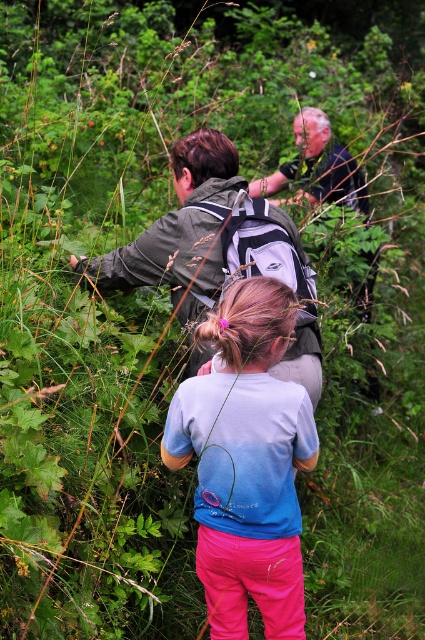
The height and width of the screenshot is (640, 425). Describe the element at coordinates (203, 234) in the screenshot. I see `green fabric jacket at center` at that location.

I want to click on green fabric jacket at center, so click(203, 234).

Is light blue cotton shirt at center further to the viewer compared to green fabric jacket at center?

No, it is in front of green fabric jacket at center.

Which is below, light blue cotton shirt at center or green fabric jacket at center?

light blue cotton shirt at center is below.

The width and height of the screenshot is (425, 640). Identify the location of light blue cotton shirt at center. [x=246, y=461].

Between light blue cotton shirt at center and dark blue shirt at center, which one is positioned lower?

light blue cotton shirt at center is lower down.

Locate an element on the screen. This screenshot has height=640, width=425. light blue cotton shirt at center is located at coordinates (246, 461).

Find the location of a particular element. This screenshot has width=425, height=640. light blue cotton shirt at center is located at coordinates (246, 461).